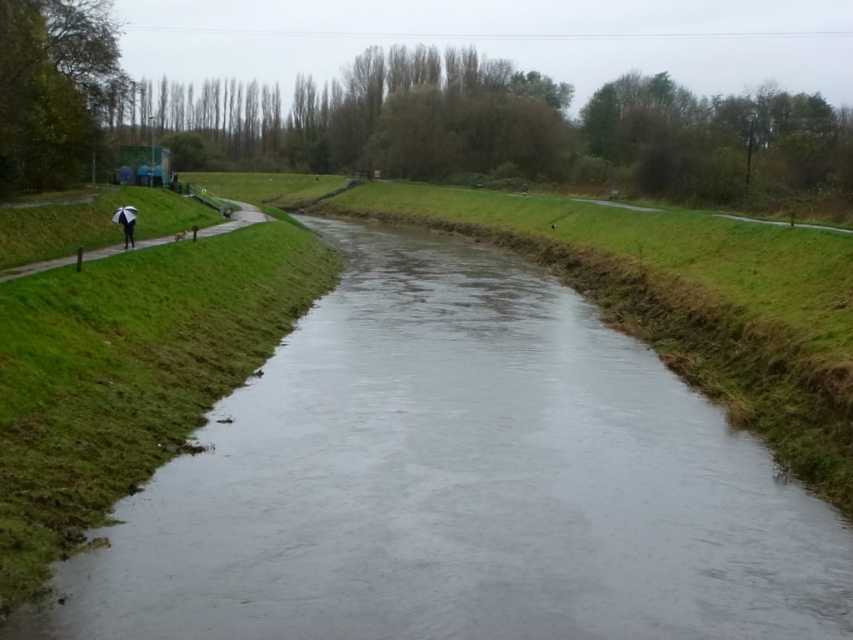
Is clear water at center shorter than white umbrella at left?

Yes, clear water at center is shorter than white umbrella at left.

Who is positioned more to the left, clear water at center or white umbrella at left?

white umbrella at left

Who is more forward, (421, 588) or (187, 230)?

Point (421, 588) is in front.

The image size is (853, 640). Identify the location of clear water at center. (457, 483).